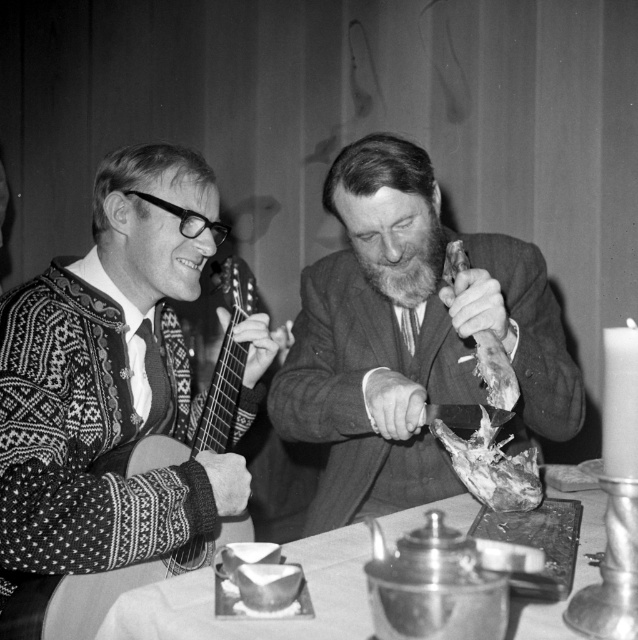
You are a chef preparing a meal and notice the raw meat at center and the leathery brown skin at right on the table. Which item is positioned lower on the table?

The raw meat at center is positioned lower on the table than the leathery brown skin at right.

You are a photographer analyzing the composition of this black and white photo. You notice the knitted sweater at left and the raw meat at center. Which object is positioned closer to the left edge of the photo?

The knitted sweater at left is positioned to the left of the raw meat at center, so it is closer to the left edge of the photo.

You are standing in front of the photograph and want to know the distance from the camera to the point marked at coordinates point [500,499]. Can you determine the distance?

The point [500,499] is 1.04 meters from the camera.